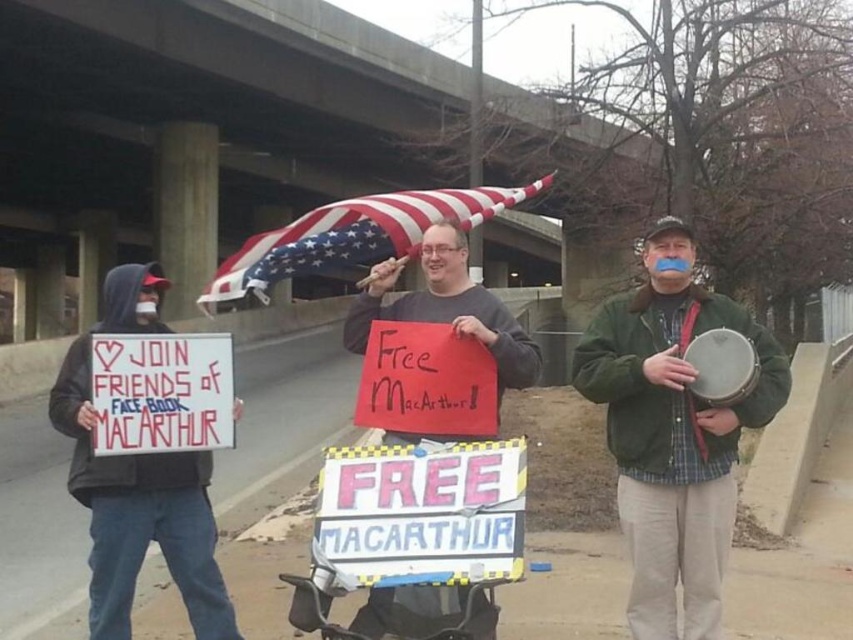
Is black hoodie at left to the right of matte black sign at center from the viewer's perspective?

In fact, black hoodie at left is to the left of matte black sign at center.

Measure the distance between black hoodie at left and matte black sign at center.

black hoodie at left and matte black sign at center are 11.70 feet apart from each other.

Who is more distant from viewer, (196, 481) or (392, 264)?

The point (196, 481) is behind.

At what (x,y) coordinates should I click in order to perform the action: click on black hoodie at left. Please return your answer as a coordinate pair (x, y). Looking at the image, I should click on (138, 483).

This screenshot has width=853, height=640. Find the location of `matte black sign at center`. matte black sign at center is located at coordinates (447, 307).

Can you confirm if matte black sign at center is thinner than american flag at center?

Yes, matte black sign at center is thinner than american flag at center.

Does point (538, 365) come in front of point (283, 252)?

Yes, point (538, 365) is closer to viewer.

Identify the location of matte black sign at center. (447, 307).

Does green fabric drum at center appear under black hoodie at left?

No, green fabric drum at center is not below black hoodie at left.

Is green fabric drum at center smaller than black hoodie at left?

Yes.

Between point (701, 518) and point (134, 538), which one is positioned in front?

Point (701, 518) is more forward.

Image resolution: width=853 pixels, height=640 pixels. Find the location of `green fabric drum at center`. green fabric drum at center is located at coordinates (672, 433).